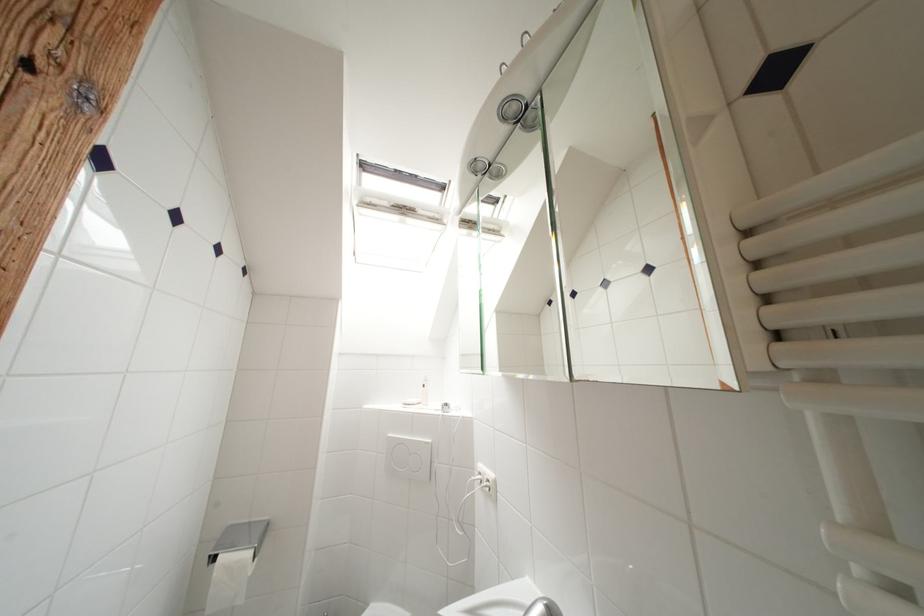
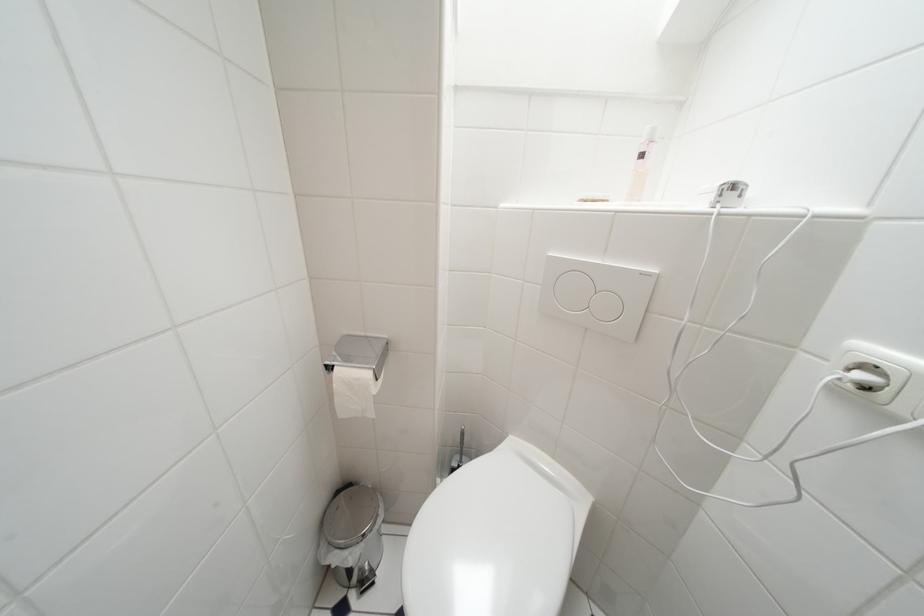
First-person continuous shooting, in which direction is the camera rotating?

The camera's rotation is toward left-down.